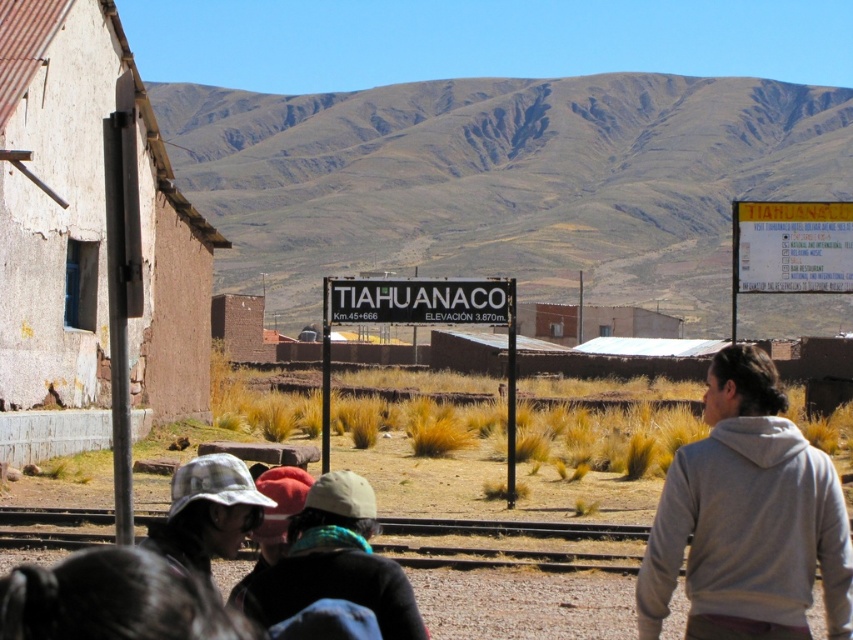
Question: Does brown rocky mountain at upper center lie behind white plastic sign at center?

Choices:
 (A) no
 (B) yes

Answer: (B)

Question: Can you confirm if white plastic sign at center is smaller than black metal sign at center?

Choices:
 (A) yes
 (B) no

Answer: (B)

Question: In this image, where is white plastic sign at center located relative to black metal sign at center?

Choices:
 (A) above
 (B) below

Answer: (B)

Question: Which point is closer to the camera taking this photo?

Choices:
 (A) (380, 307)
 (B) (775, 323)
 (C) (509, 477)
 (D) (233, 509)

Answer: (D)

Question: Which of the following is the farthest from the observer?

Choices:
 (A) white paper sign at upper right
 (B) white plastic sign at center

Answer: (A)

Question: Which object appears farthest from the camera in this image?

Choices:
 (A) brown rocky mountain at upper center
 (B) plaid fabric hat at lower left
 (C) black metal sign at center

Answer: (A)